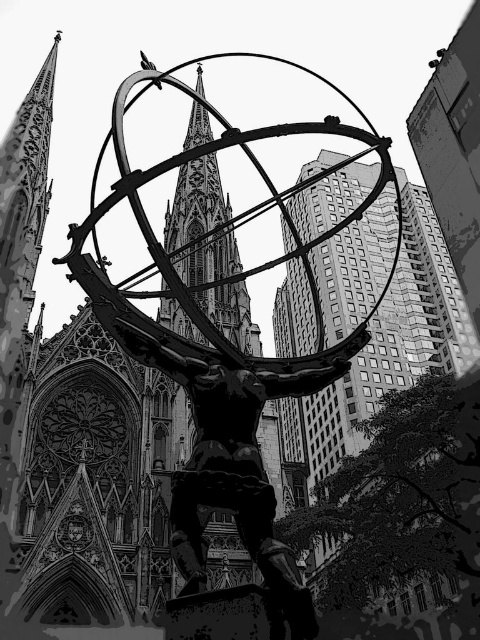
Is metallic statue at center below smooth stone spire at center?

Yes, metallic statue at center is below smooth stone spire at center.

Who is shorter, metallic statue at center or smooth stone spire at center?

Standing shorter between the two is smooth stone spire at center.

Is point (344, 342) more distant than point (167, 230)?

No, (344, 342) is closer to viewer.

At what (x,y) coordinates should I click in order to perform the action: click on metallic statue at center. Please return your answer as a coordinate pair (x, y). Looking at the image, I should click on (223, 356).